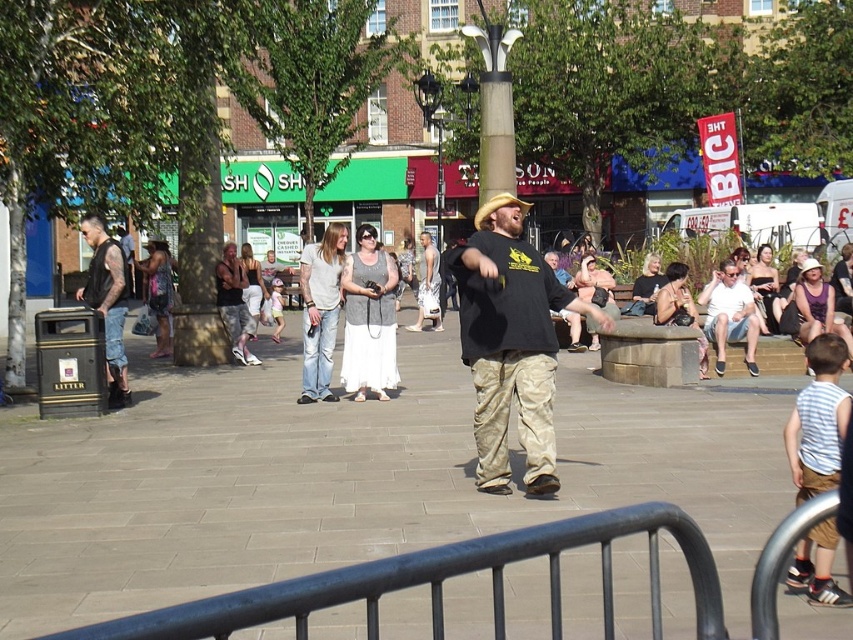
Question: Is metallic gray railing at center in front of black leather vest at left?

Choices:
 (A) yes
 (B) no

Answer: (A)

Question: Which object is the closest to the metallic gray railing at center?

Choices:
 (A) black leather vest at left
 (B) black matte t-shirt at center

Answer: (B)

Question: Does metallic gray railing at center have a larger size compared to black matte t-shirt at center?

Choices:
 (A) yes
 (B) no

Answer: (B)

Question: Which point appears farthest from the camera in this image?

Choices:
 (A) 247,621
 (B) 117,296

Answer: (B)

Question: Based on their relative distances, which object is farther from the metallic gray railing at center?

Choices:
 (A) black leather vest at left
 (B) black matte t-shirt at center

Answer: (A)

Question: Can you confirm if metallic gray railing at center is positioned above black matte t-shirt at center?

Choices:
 (A) no
 (B) yes

Answer: (A)